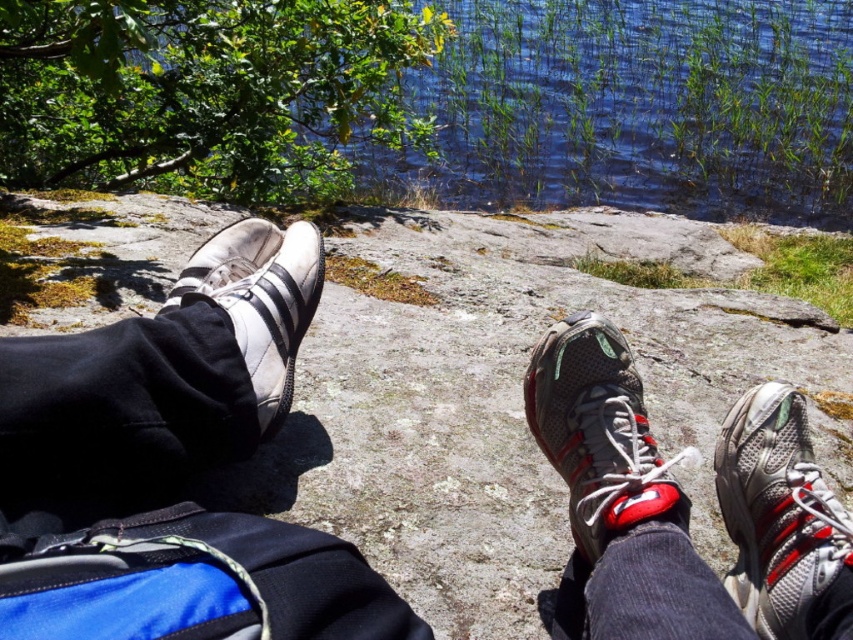
You are standing at the viewpoint of the image and want to place a 30 inch long wooden plank between yourself and the point at coordinate point (751, 490). Will the plank reach the point?

The distance between you and the point (751, 490) is 31.64 inches. Since the plank is 30 inches long, it will not be long enough to reach the point.

You are a hiker who wants to choose between the silver mesh shoe at lower right and the gray mesh shoe at center for better stability on the rocky ground. Which shoe should you pick based on their sizes?

The gray mesh shoe at center is larger than the silver mesh shoe at lower right, so it provides better stability on rocky ground due to its larger size.

You are standing in the scene and want to place a small rock between the silver mesh shoe at lower right and the gray mesh shoe at center. Based on their positions, where should you place the rock to ensure it is between them?

The silver mesh shoe at lower right is below the gray mesh shoe at center, so you should place the rock between them along the vertical axis, positioning it below the gray mesh shoe at center and above the silver mesh shoe at lower right.